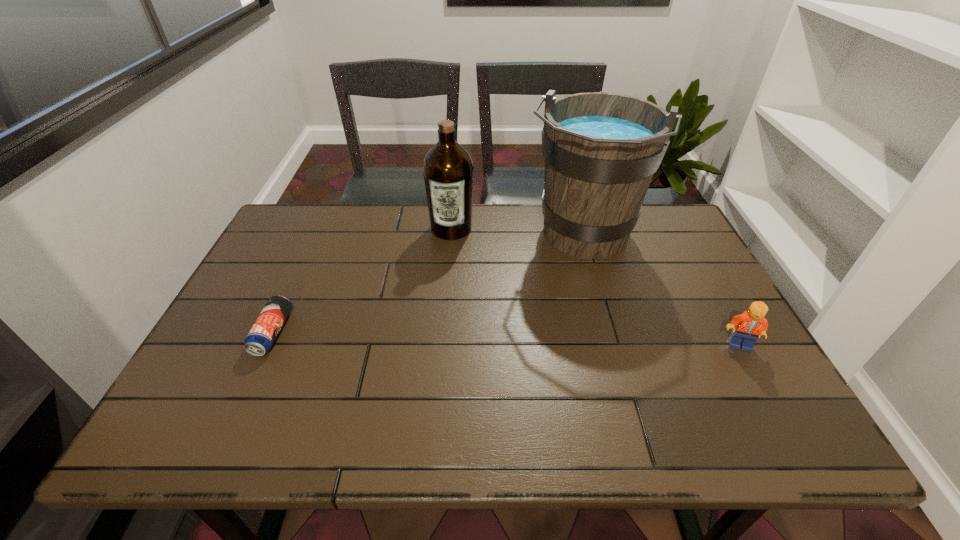
Find the location of `vacant space located 0.300m on the label of the third shortest object`. vacant space located 0.300m on the label of the third shortest object is located at coordinates (439, 314).

This screenshot has height=540, width=960. I want to click on vacant space located 0.130m on the label of the third shortest object, so click(x=444, y=271).

At what (x,y) coordinates should I click in order to perform the action: click on vacant space located on the label of the third shortest object. Please return your answer as a coordinate pair (x, y). Looking at the image, I should click on (446, 259).

Find the location of a particular element. The width and height of the screenshot is (960, 540). vacant space located 0.300m with a handle on the side of the third object from left to right is located at coordinates (540, 352).

In order to click on vacant space located 0.050m with a handle on the side of the third object from left to right in this screenshot , I will do `click(564, 285)`.

The width and height of the screenshot is (960, 540). Identify the location of vacant space situated with a handle on the side of the third object from left to right. (563, 289).

Locate an element on the screen. This screenshot has width=960, height=540. olive oil that is at the far edge is located at coordinates (448, 170).

What are the coordinates of `wine bucket at the far edge` in the screenshot? It's located at (601, 150).

Locate an element on the screen. The width and height of the screenshot is (960, 540). object at the left edge is located at coordinates click(260, 339).

In order to click on Lego that is at the right edge in this screenshot , I will do `click(750, 325)`.